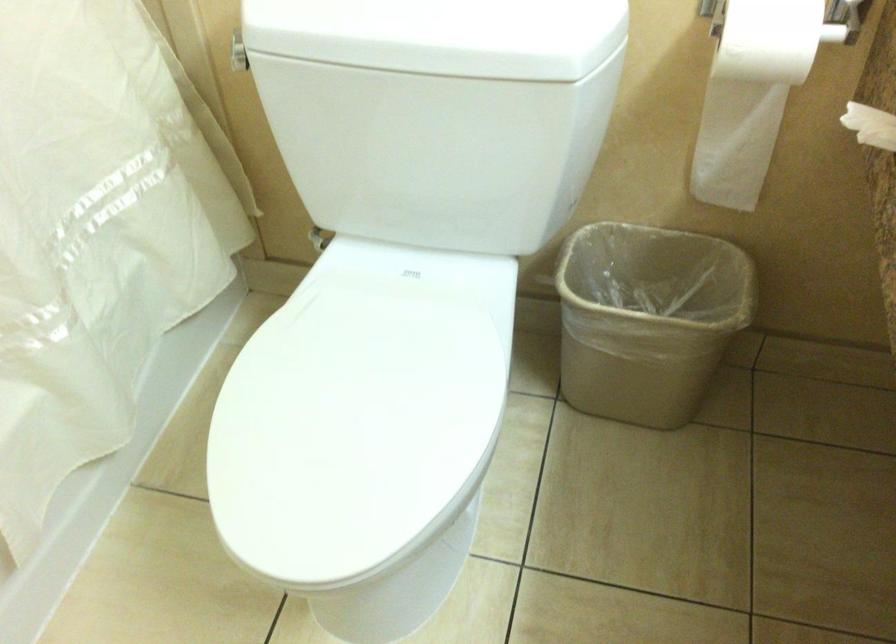
Which object does [647,319] point to?

This point indicates the tan trash can.